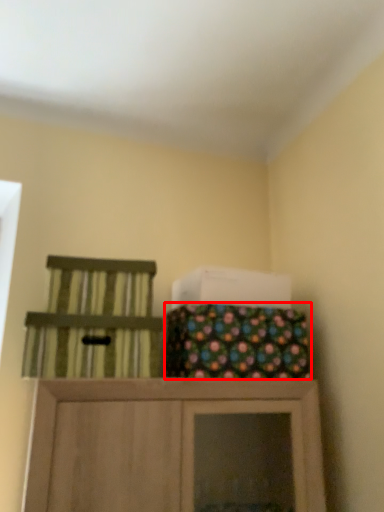
Question: Observing the image, what is the correct spatial positioning of material (annotated by the red box) in reference to chair?

Choices:
 (A) left
 (B) right

Answer: (B)